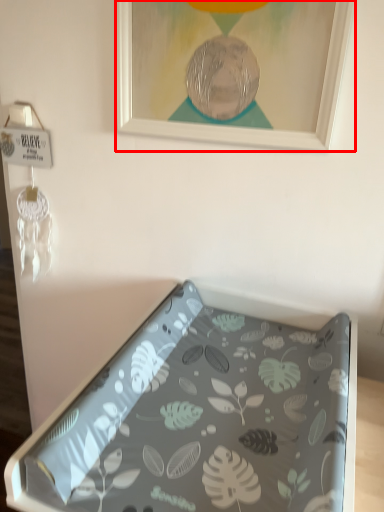
Question: From the image's perspective, where is picture frame (annotated by the red box) located in relation to furniture in the image?

Choices:
 (A) above
 (B) below

Answer: (A)